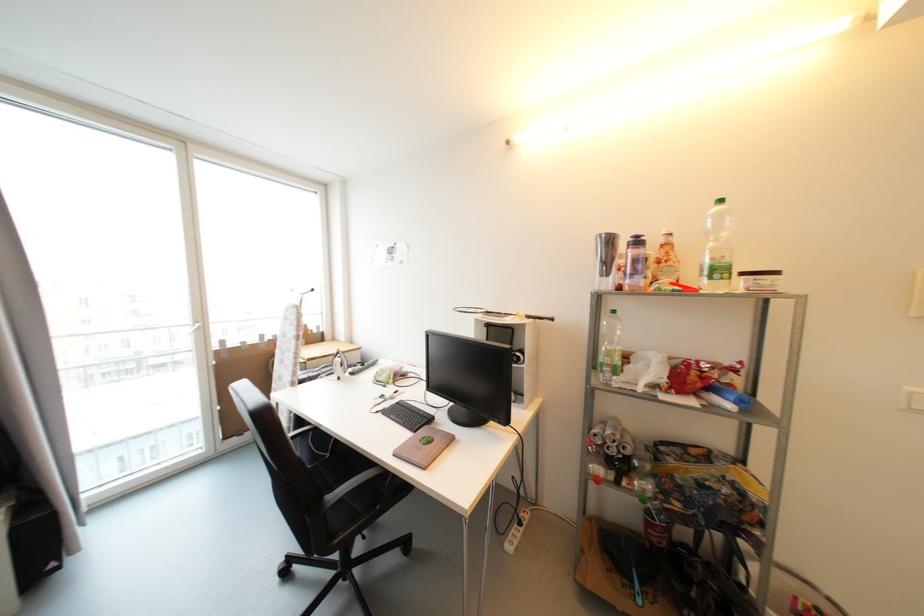
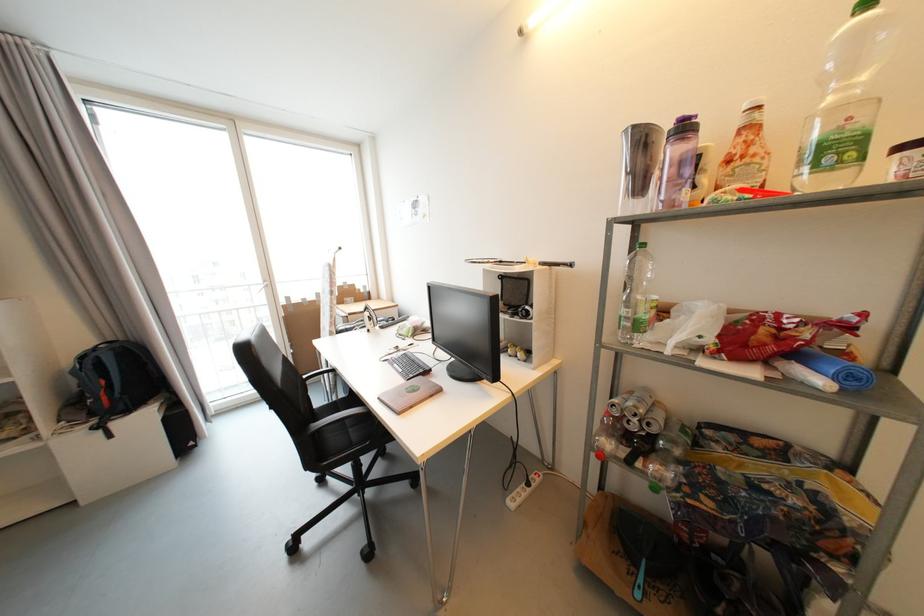
Where in the second image is the point corresponding to the point at 617,454 from the first image?

(638, 430)